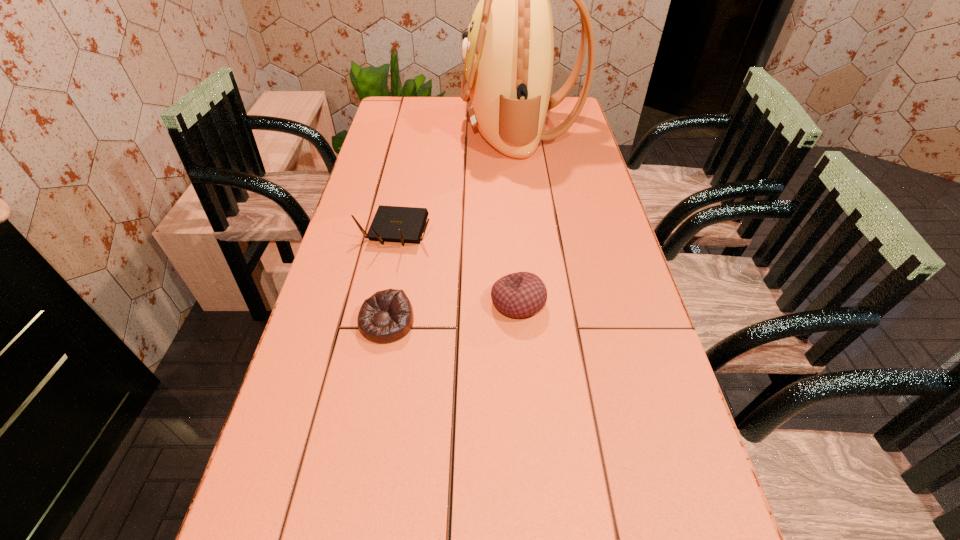
The height and width of the screenshot is (540, 960). In order to click on the tallest object in this screenshot , I will do `click(508, 51)`.

At what (x,y) coordinates should I click in order to perform the action: click on the farthest object. Please return your answer as a coordinate pair (x, y). The height and width of the screenshot is (540, 960). Looking at the image, I should click on (508, 51).

This screenshot has width=960, height=540. I want to click on router, so click(x=397, y=224).

At what (x,y) coordinates should I click in order to perform the action: click on the right beanbag. Please return your answer as a coordinate pair (x, y). Looking at the image, I should click on (518, 295).

Where is `the shorter beanbag`? the shorter beanbag is located at coordinates (387, 316).

Locate an element on the screen. This screenshot has width=960, height=540. the left beanbag is located at coordinates (387, 316).

Locate an element on the screen. vacant space situated 0.110m on the front-facing side of the backpack is located at coordinates (433, 129).

At what (x,y) coordinates should I click in order to perform the action: click on vacant space situated on the front-facing side of the backpack. Please return your answer as a coordinate pair (x, y). This screenshot has width=960, height=540. Looking at the image, I should click on click(x=375, y=129).

Image resolution: width=960 pixels, height=540 pixels. What are the coordinates of `free space located on the front-facing side of the backpack` in the screenshot? It's located at (446, 129).

Identify the location of free point located 0.090m on the back of the router. This screenshot has width=960, height=540. pyautogui.click(x=404, y=193).